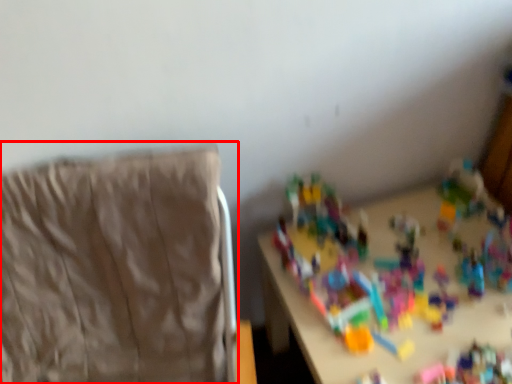
Question: From the image's perspective, what is the correct spatial positioning of furniture (annotated by the red box) in reference to toy?

Choices:
 (A) below
 (B) above

Answer: (A)